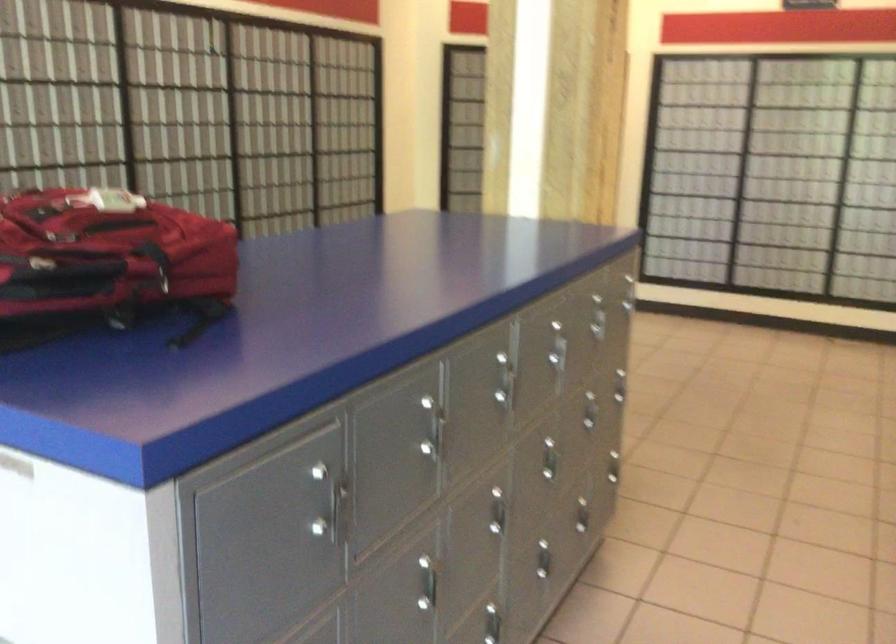
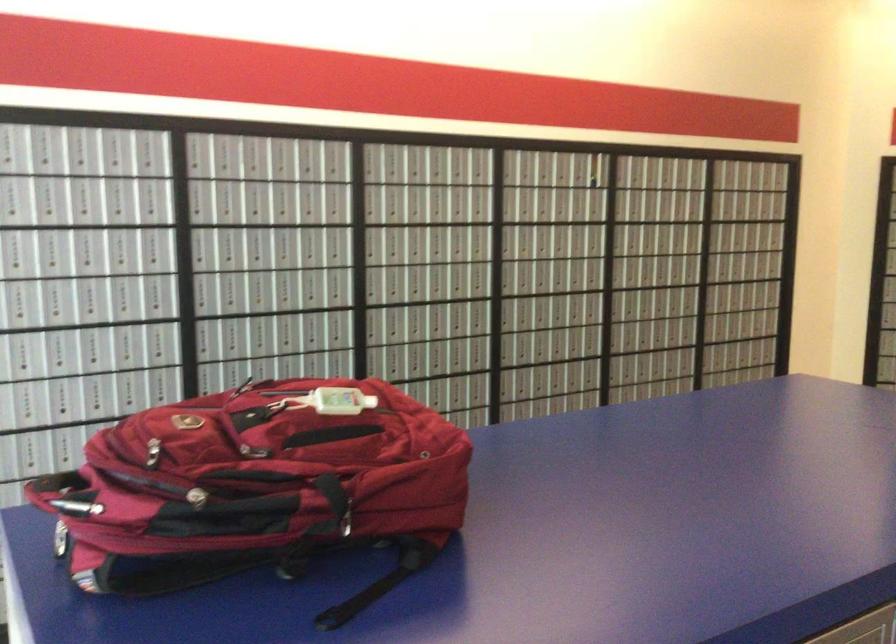
Question: The images are taken continuously from a first-person perspective. In which direction is your viewpoint rotating?

Choices:
 (A) Left
 (B) Right
 (C) Up
 (D) Down

Answer: (A)